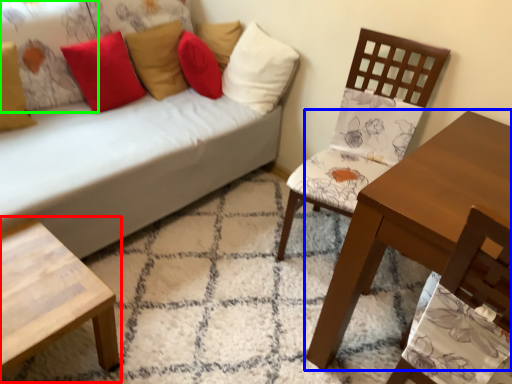
Question: Which object is the farthest from coffee table (highlighted by a red box)? Choose among these: table (highlighted by a blue box) or pillow (highlighted by a green box).

Choices:
 (A) table
 (B) pillow

Answer: (B)